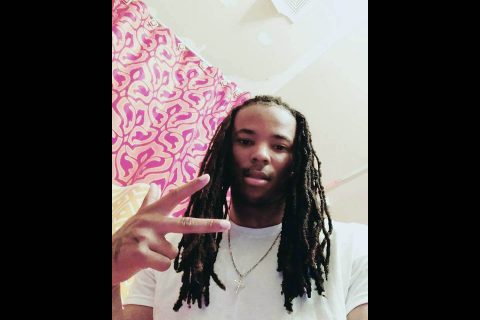
The image size is (480, 320). Find the location of `ceiling`. ceiling is located at coordinates (232, 49).